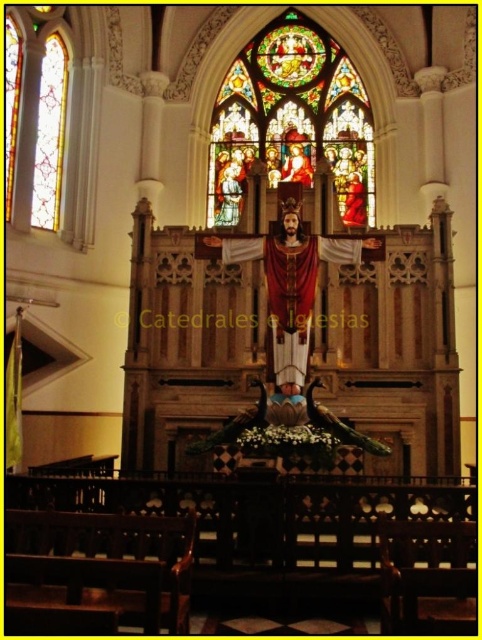
Does stained glass at upper center have a lesser height compared to stained glass window at left?

No, stained glass at upper center is not shorter than stained glass window at left.

Measure the distance between point (270, 116) and camera.

Point (270, 116) is 99.35 meters away from camera.

Between point (334, 74) and point (42, 28), which one is positioned in front?

Positioned in front is point (42, 28).

This screenshot has width=482, height=640. In order to click on stained glass at upper center in this screenshot , I will do `click(292, 120)`.